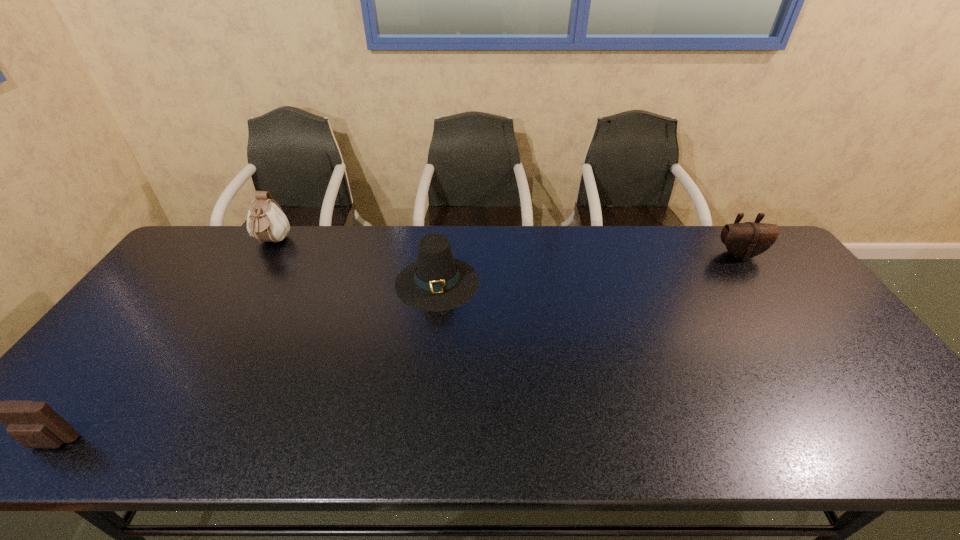
Identify the location of object that ranks as the closest to the second object from right to left. The height and width of the screenshot is (540, 960). (266, 221).

Locate which pouch ranks in proximity to the third object from left to right. Please provide its 2D coordinates. Your answer should be formatted as a tuple, i.e. [(x, y)], where the tuple contains the x and y coordinates of a point satisfying the conditions above.

[(266, 221)]

Find the location of a particular element. pouch that is the second nearest to the third object from left to right is located at coordinates (33, 424).